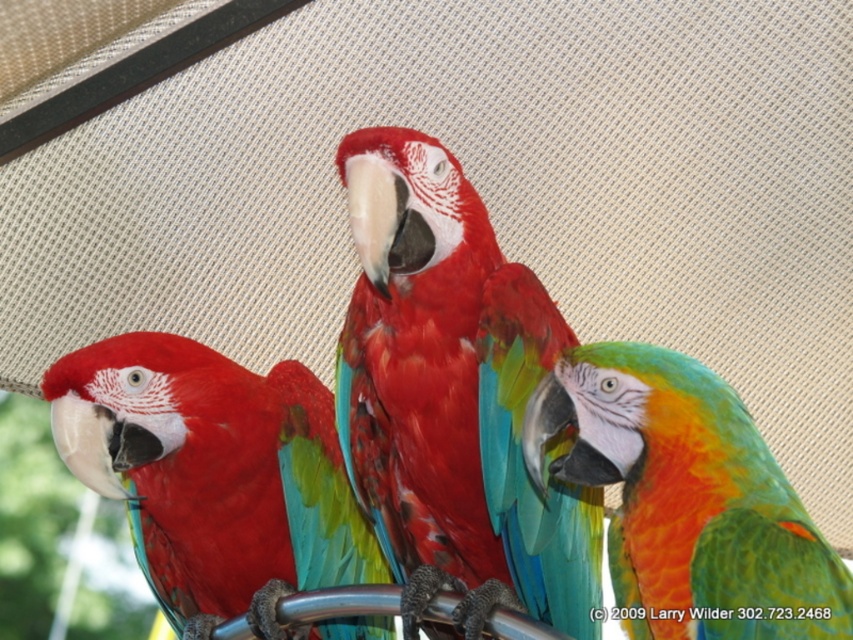
Based on the photo, you are standing 5 feet away from the cage where the macaws are perched. There is a point marked at coordinates point (360, 225) in the image. Can you reach that point without moving closer to the cage?

The distance of point (360, 225) from the camera is 5.39 feet. Since you are currently 5 feet away from the cage, you need to move 0.39 feet closer to reach the point. Therefore, you cannot reach the point without moving closer to the cage.